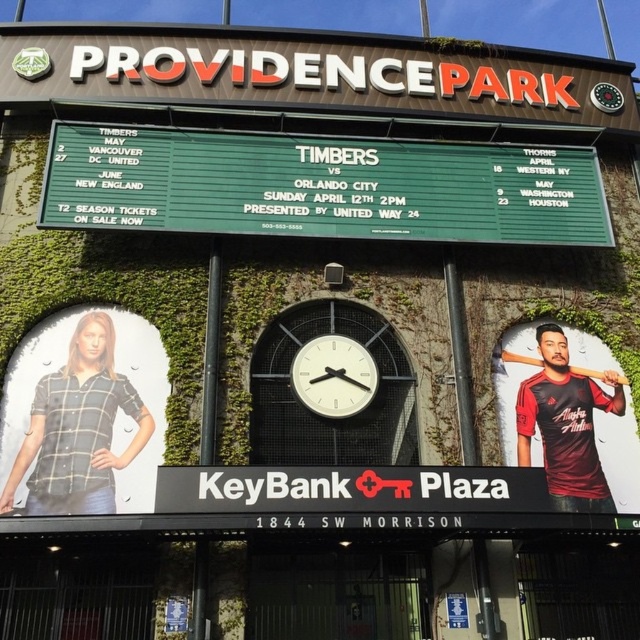
You are a vendor at Providence Park and need to place a promotional banner that requires 4 square feet of space. You have the green wooden scoreboard at center and the black matte baseball bat at center available. Which object can accommodate the banner based on their sizes?

The green wooden scoreboard at center has a larger size compared to the black matte baseball bat at center, so the promotional banner requiring 4 square feet of space can be placed on the green wooden scoreboard at center.

You are a fan entering Providence Park and notice the maroon jersey at right and the black matte baseball bat at center. Which object is positioned to the left of the other?

The maroon jersey at right is to the left of the black matte baseball bat at center.

You are a visitor at Providence Park and want to take a photo of both the green wooden scoreboard at center and the black matte baseball bat at center without moving your position. Can you fit both objects in your camera frame if your camera has a maximum field of view of 50 feet? Explain your reasoning.

The green wooden scoreboard at center and the black matte baseball bat at center are 52.35 feet apart. Since the distance between them exceeds the camera field of view of 50 feet, you cannot fit both objects in the frame without moving your position.